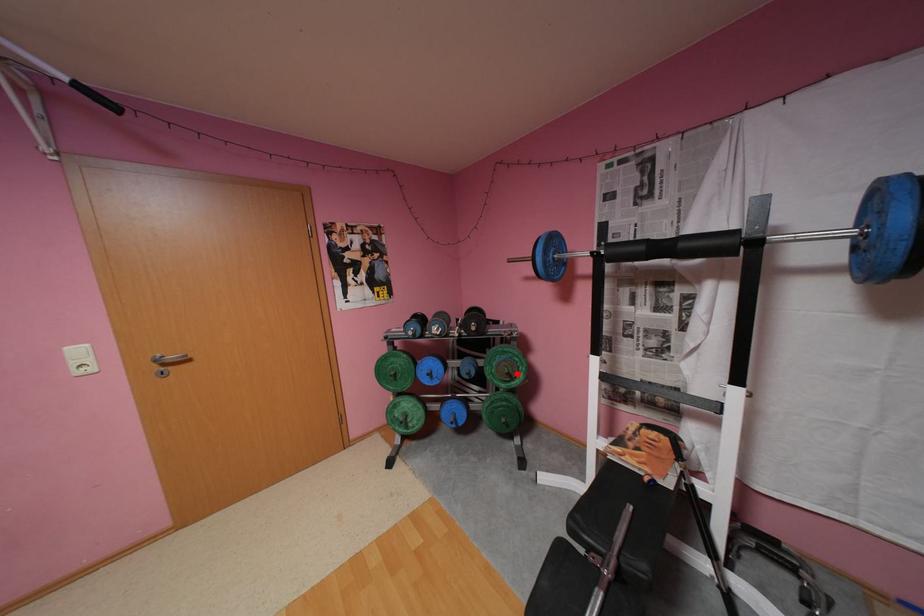
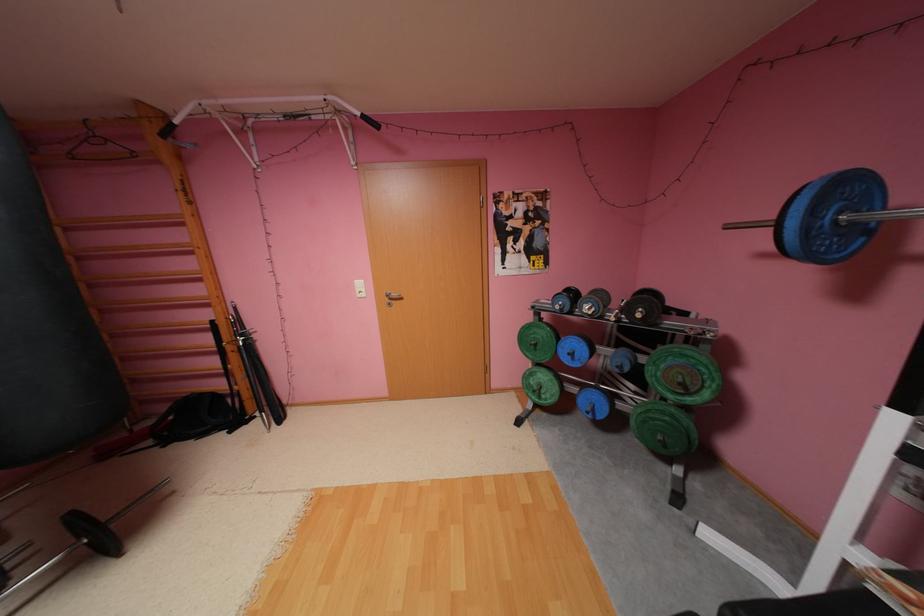
Question: I am providing you with two images of the same scene from different viewpoints. Given a red point in image1, look at the same physical point in image2. Is it:

Choices:
 (A) Closer to the viewpoint
 (B) Farther from the viewpoint

Answer: (A)